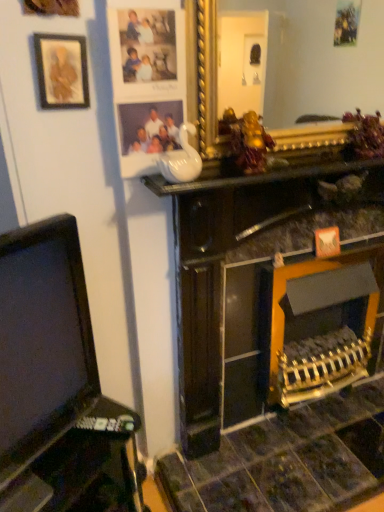
Question: From the image's perspective, relative to white glossy vase at upper center, is matte gold picture frame at upper left, which appears as the 2th picture frame when viewed from the right, above or below?

Choices:
 (A) below
 (B) above

Answer: (B)

Question: Is matte gold picture frame at upper left, the first picture frame viewed from the left, inside or outside of white glossy vase at upper center?

Choices:
 (A) outside
 (B) inside

Answer: (A)

Question: Which is nearer to the white glossy vase at upper center?

Choices:
 (A) black plastic tv at left
 (B) matte gold picture frame at upper left, which appears as the 2th picture frame when viewed from the right
 (C) gold/gilded mirror at upper center
 (D) matte plastic picture frame at upper center, which is the 2th picture frame from left to right

Answer: (D)

Question: Estimate the real-world distances between objects in this image. Which object is farther from the matte plastic picture frame at upper center, which is the 2th picture frame from left to right?

Choices:
 (A) black plastic tv at left
 (B) white glossy vase at upper center
 (C) matte gold picture frame at upper left, which appears as the 2th picture frame when viewed from the right
 (D) gold/gilded mirror at upper center

Answer: (D)